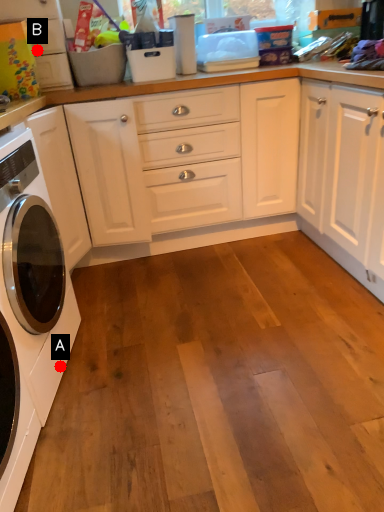
Question: Two points are circled on the image, labeled by A and B beside each circle. Among these points, which one is nearest to the camera?

Choices:
 (A) A is closer
 (B) B is closer

Answer: (A)